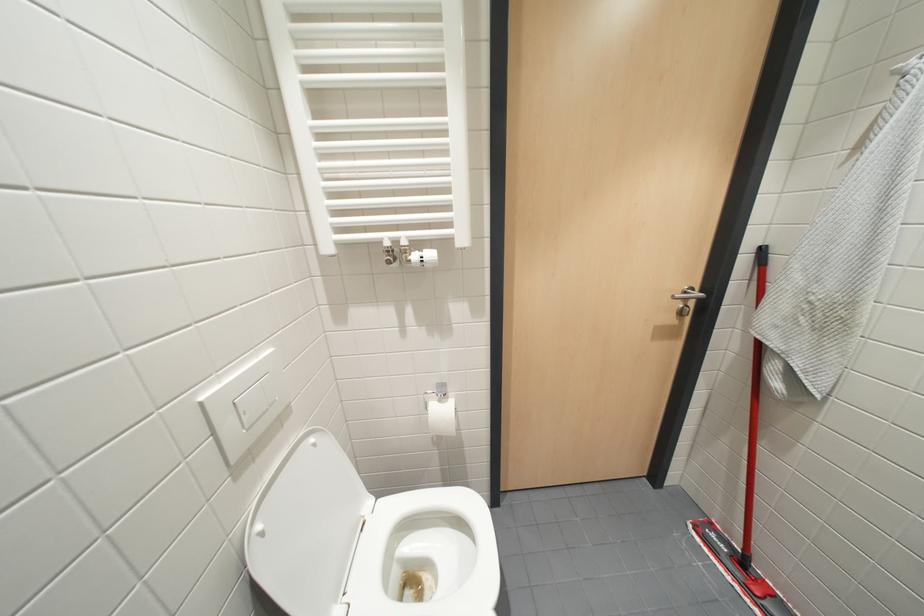
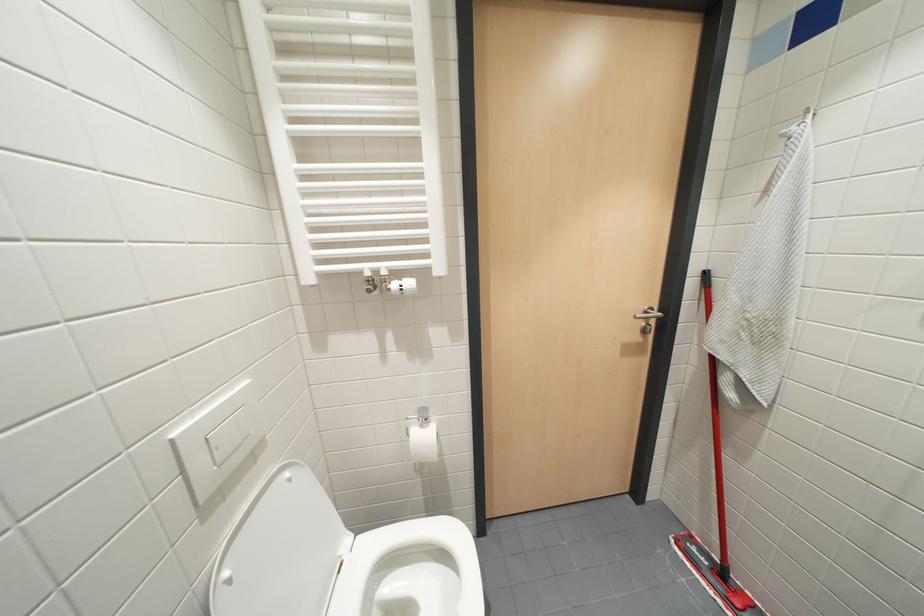
Question: The first image is from the beginning of the video and the second image is from the end. How did the camera likely rotate when shooting the video?

Choices:
 (A) Left
 (B) Right
 (C) Up
 (D) Down

Answer: (C)